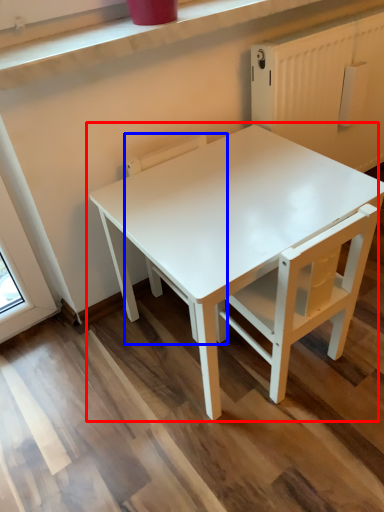
Question: Which of the following is the closest to the observer, table (highlighted by a red box) or chair (highlighted by a blue box)?

Choices:
 (A) table
 (B) chair

Answer: (A)